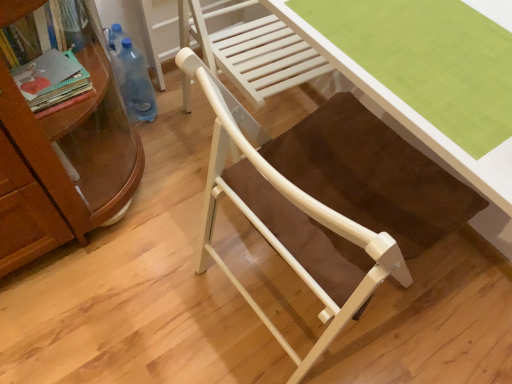
Where is `free space above green fabric desk at center (from a real-world perspective)`? free space above green fabric desk at center (from a real-world perspective) is located at coordinates (430, 43).